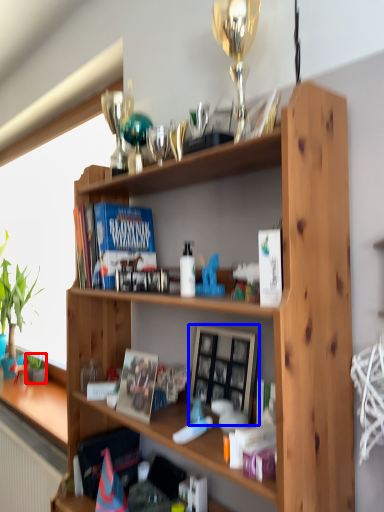
Question: Which point is further to the camera, houseplant (highlighted by a red box) or picture frame (highlighted by a blue box)?

Choices:
 (A) houseplant
 (B) picture frame

Answer: (A)